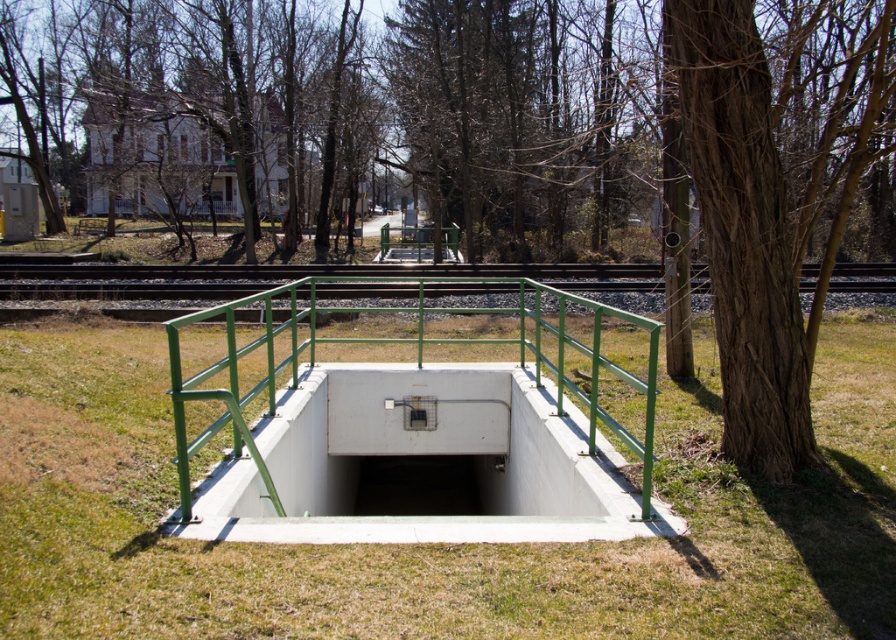
Between white concrete rail at center and white concrete hole at center, which one has less height?

white concrete hole at center

Can you confirm if white concrete rail at center is positioned to the right of white concrete hole at center?

Incorrect, white concrete rail at center is not on the right side of white concrete hole at center.

What do you see at coordinates (416, 435) in the screenshot? Image resolution: width=896 pixels, height=640 pixels. I see `white concrete rail at center` at bounding box center [416, 435].

Find the location of a particular element. The height and width of the screenshot is (640, 896). white concrete rail at center is located at coordinates (416, 435).

Is green grass at center thinner than white concrete hole at center?

Incorrect, green grass at center's width is not less than white concrete hole at center's.

The height and width of the screenshot is (640, 896). I want to click on green grass at center, so click(x=440, y=545).

Is green grass at center to the left of white concrete rail at center from the viewer's perspective?

Correct, you'll find green grass at center to the left of white concrete rail at center.

Can you confirm if green grass at center is smaller than white concrete rail at center?

Yes, green grass at center is smaller than white concrete rail at center.

Which is behind, point (78, 461) or point (645, 397)?

Positioned behind is point (645, 397).

You are a GUI agent. You are given a task and a screenshot of the screen. Output one action in this format:
    pyautogui.click(x=<x>, y=<y>)
    Task: Click on the green grass at center
    The width and height of the screenshot is (896, 640).
    Given the screenshot: What is the action you would take?
    pyautogui.click(x=440, y=545)